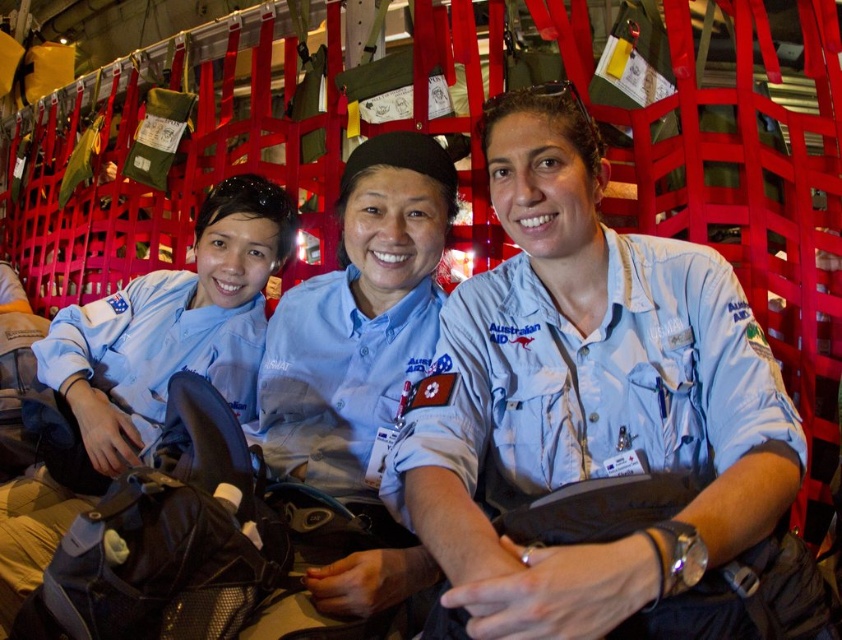
Does light blue fabric shirt at center have a lesser height compared to blue uniform shirt at center?

Correct, light blue fabric shirt at center is not as tall as blue uniform shirt at center.

Is light blue fabric shirt at center positioned before blue uniform shirt at center?

Yes, it is.

Does point (546, 570) come closer to viewer compared to point (369, 300)?

Yes, it is.

In order to click on light blue fabric shirt at center in this screenshot , I will do `click(593, 426)`.

Which is above, light blue fabric shirt at center or matte blue uniform at center?

matte blue uniform at center is higher up.

Who is taller, light blue fabric shirt at center or matte blue uniform at center?

Standing taller between the two is matte blue uniform at center.

What do you see at coordinates (593, 426) in the screenshot? This screenshot has height=640, width=842. I see `light blue fabric shirt at center` at bounding box center [593, 426].

At what (x,y) coordinates should I click in order to perform the action: click on light blue fabric shirt at center. Please return your answer as a coordinate pair (x, y). This screenshot has height=640, width=842. Looking at the image, I should click on (593, 426).

Is blue uniform shirt at center to the right of matte blue uniform at center from the viewer's perspective?

Indeed, blue uniform shirt at center is positioned on the right side of matte blue uniform at center.

Does blue uniform shirt at center appear under matte blue uniform at center?

Correct, blue uniform shirt at center is located below matte blue uniform at center.

The height and width of the screenshot is (640, 842). In order to click on blue uniform shirt at center in this screenshot , I will do `click(360, 360)`.

Locate an element on the screen. This screenshot has height=640, width=842. blue uniform shirt at center is located at coordinates pos(360,360).